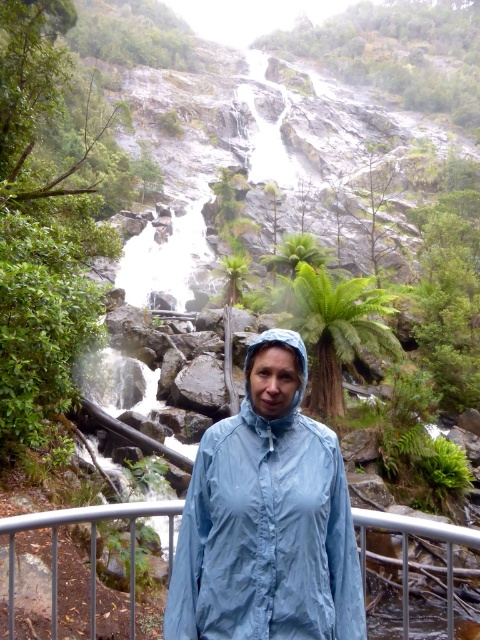
Can you confirm if light blue nylon jacket at center is positioned below metallic gray rail at lower center?

No.

Is light blue nylon jacket at center to the right of metallic gray rail at lower center from the viewer's perspective?

No, light blue nylon jacket at center is not to the right of metallic gray rail at lower center.

Is point (226, 476) closer to viewer compared to point (405, 616)?

Yes, it is in front of point (405, 616).

At what (x,y) coordinates should I click in order to perform the action: click on light blue nylon jacket at center. Please return your answer as a coordinate pair (x, y). This screenshot has height=640, width=480. Looking at the image, I should click on (266, 518).